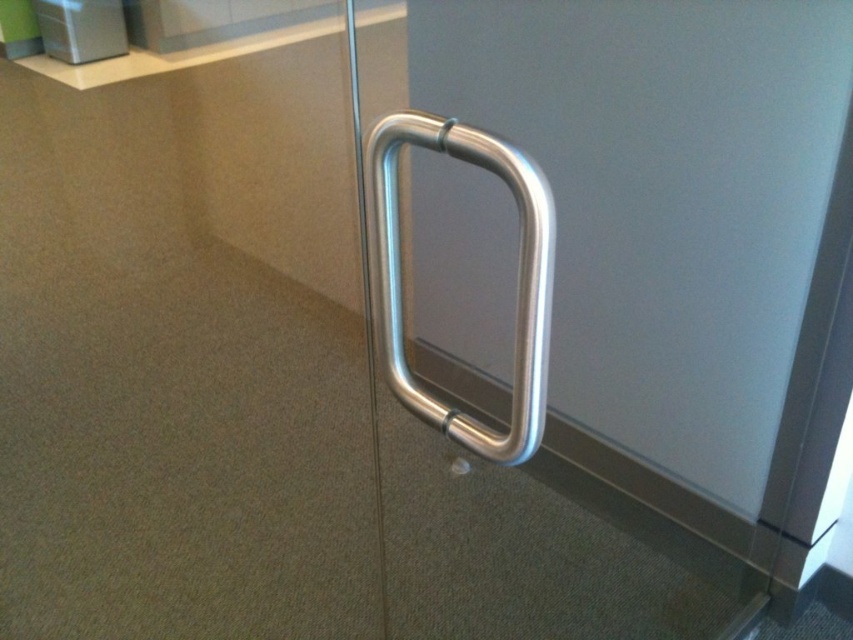
Question: Can you confirm if silver metallic handle at center is wider than polished metal door handle at right?

Choices:
 (A) no
 (B) yes

Answer: (B)

Question: Among these objects, which one is farthest from the camera?

Choices:
 (A) silver metallic handle at center
 (B) polished metal door handle at right

Answer: (A)

Question: Can you confirm if silver metallic handle at center is positioned above polished metal door handle at right?

Choices:
 (A) yes
 (B) no

Answer: (B)

Question: Is silver metallic handle at center above polished metal door handle at right?

Choices:
 (A) no
 (B) yes

Answer: (A)